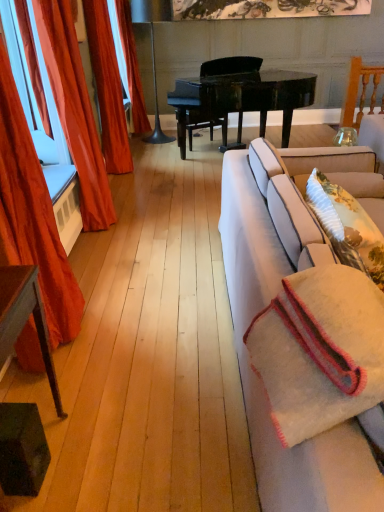
In order to click on vacant point to the right of green painted wood side table at lower left in this screenshot , I will do `click(116, 455)`.